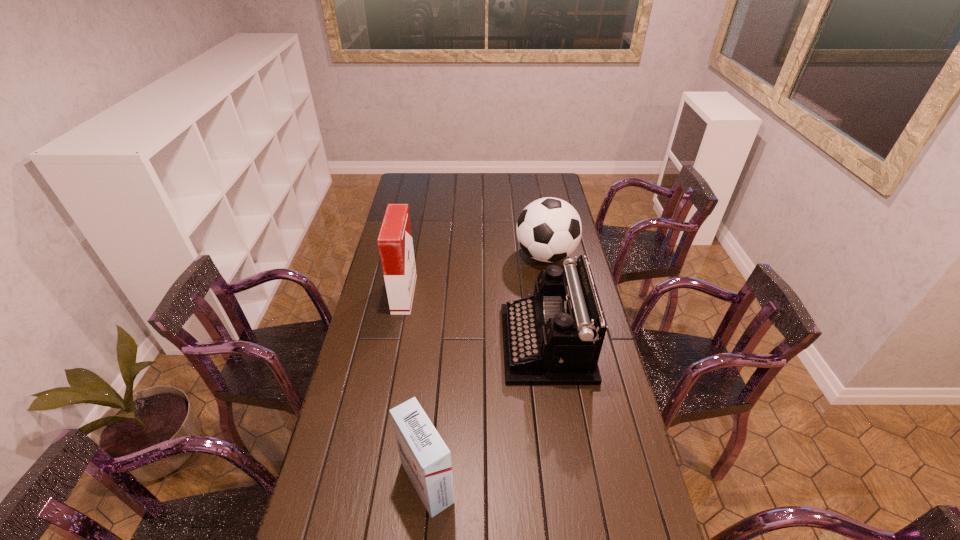
At what (x,y) coordinates should I click in order to perform the action: click on free spot that satisfies the following two spatial constraints: 1. on the front-facing side of the farther cigarette case; 2. on the back side of the right cigarette case. Please return your answer as a coordinate pair (x, y). Looking at the image, I should click on (369, 482).

Image resolution: width=960 pixels, height=540 pixels. Identify the location of free space that satisfies the following two spatial constraints: 1. on the front-facing side of the second object from left to right; 2. on the right side of the farther cigarette case. (369, 482).

Locate an element on the screen. free location that satisfies the following two spatial constraints: 1. on the typing side of the typewriter; 2. on the front side of the nearest object is located at coordinates (567, 482).

You are a GUI agent. You are given a task and a screenshot of the screen. Output one action in this format:
    pyautogui.click(x=<x>, y=<y>)
    Task: Click on the free space that satisfies the following two spatial constraints: 1. on the front-facing side of the third object from right to left; 2. on the left side of the leftmost object
    
    Given the screenshot: What is the action you would take?
    point(369,482)